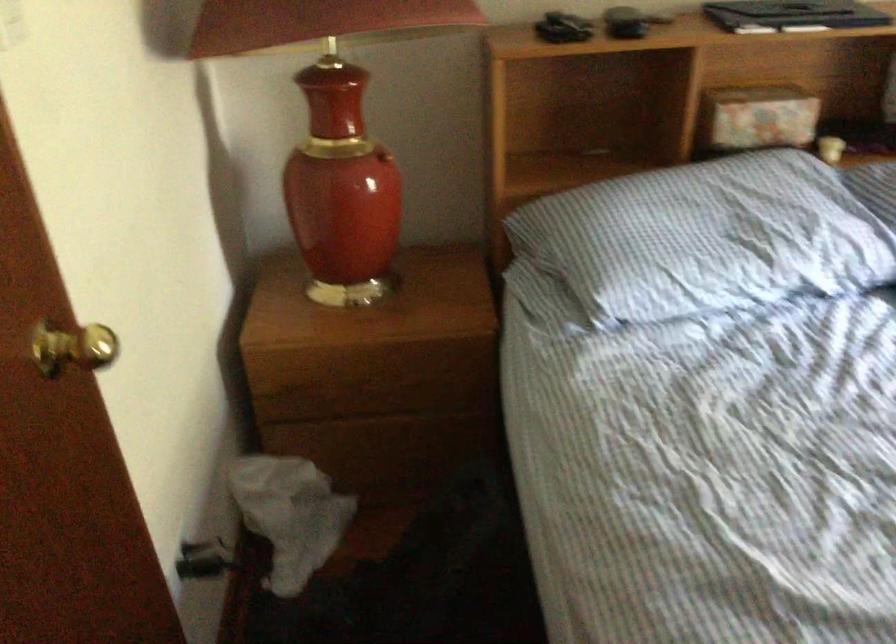
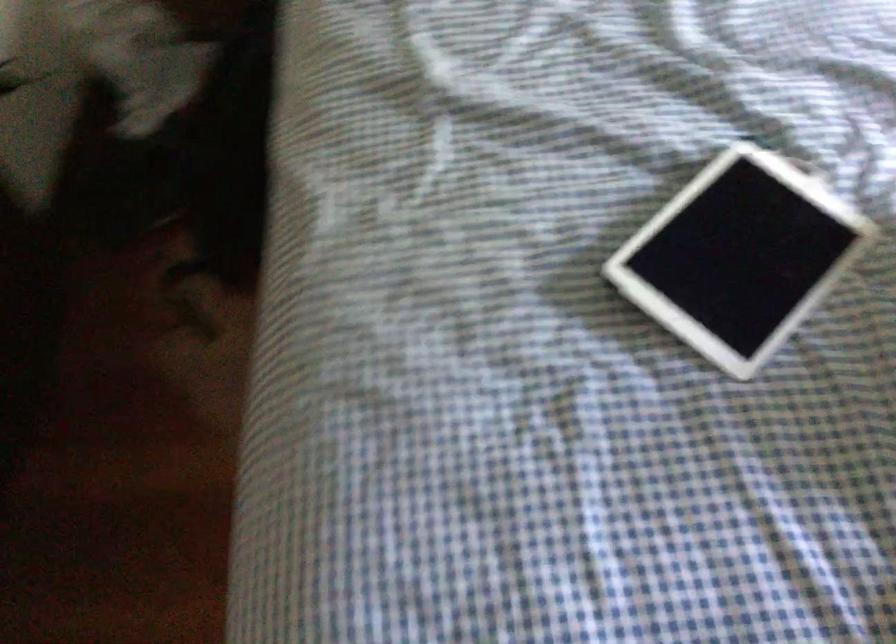
Question: In a continuous first-person perspective shot, in which direction is the camera moving?

Choices:
 (A) Left
 (B) Right
 (C) Forward
 (D) Backward

Answer: (B)